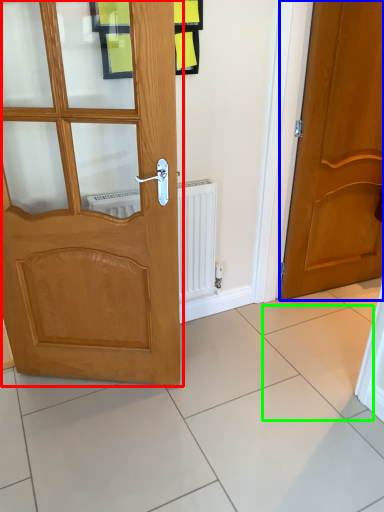
Question: Which object is positioned farthest from door (highlighted by a red box)? Select from door (highlighted by a blue box) and ceramic tile (highlighted by a green box).

Choices:
 (A) door
 (B) ceramic tile

Answer: (A)